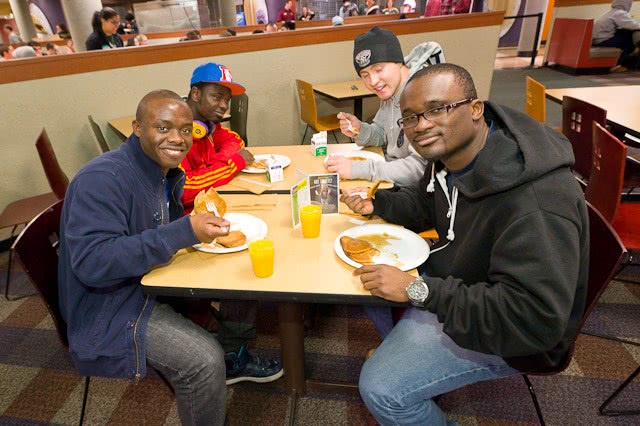
Find the location of a particular element. This screenshot has height=426, width=640. man sitting at table is located at coordinates (532, 231), (118, 218), (224, 145), (388, 118).